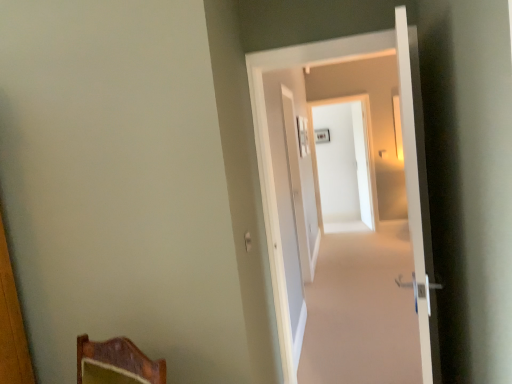
Question: Which direction should I rotate to look at white glossy screen door at center, acting as the second screen door starting from the left?

Choices:
 (A) right
 (B) left

Answer: (A)

Question: Is white glossy door at center, arranged as the 2th screen door when viewed from the right, not near white glossy door at center, acting as the second door starting from the front?

Choices:
 (A) yes
 (B) no

Answer: (A)

Question: Does white glossy door at center, marked as the 1th screen door in a front-to-back arrangement, appear on the left side of white glossy door at center, acting as the second door starting from the front?

Choices:
 (A) yes
 (B) no

Answer: (A)

Question: Is white glossy door at center, arranged as the 2th screen door when viewed from the right, turned away from white glossy door at center, acting as the second door starting from the front?

Choices:
 (A) yes
 (B) no

Answer: (B)

Question: From a real-world perspective, is white glossy door at center, the 2th screen door in the back-to-front sequence, on white glossy door at center, acting as the second door starting from the front?

Choices:
 (A) no
 (B) yes

Answer: (A)

Question: Is white glossy door at center, marked as the 1th screen door in a front-to-back arrangement, placed right next to white glossy door at center, acting as the second door starting from the front?

Choices:
 (A) yes
 (B) no

Answer: (B)

Question: Is white glossy door at center, the 2th screen door in the back-to-front sequence, bigger than white glossy door at center, acting as the second door starting from the front?

Choices:
 (A) no
 (B) yes

Answer: (B)

Question: Is white glossy door at right, marked as the second door in a back-to-front arrangement, positioned before white glossy door at center, positioned as the first screen door in left-to-right order?

Choices:
 (A) yes
 (B) no

Answer: (A)

Question: Is white glossy door at right, the first door in the front-to-back sequence, bigger than white glossy door at center, the 2th screen door in the back-to-front sequence?

Choices:
 (A) yes
 (B) no

Answer: (A)

Question: Is white glossy door at right, the first door in the front-to-back sequence, to the right of white glossy door at center, positioned as the first screen door in left-to-right order, from the viewer's perspective?

Choices:
 (A) yes
 (B) no

Answer: (A)

Question: Is white glossy door at right, the first door in the front-to-back sequence, not inside white glossy door at center, positioned as the first screen door in left-to-right order?

Choices:
 (A) yes
 (B) no

Answer: (A)

Question: From the image's perspective, is white glossy door at right, marked as the second door in a back-to-front arrangement, under white glossy door at center, marked as the 1th screen door in a front-to-back arrangement?

Choices:
 (A) yes
 (B) no

Answer: (A)

Question: From a real-world perspective, is white glossy door at right, the first door in the front-to-back sequence, under white glossy door at center, the 2th screen door in the back-to-front sequence?

Choices:
 (A) yes
 (B) no

Answer: (B)

Question: From a real-world perspective, is white glossy door at center, arranged as the 2th screen door when viewed from the right, located beneath white glossy door at right, marked as the second door in a back-to-front arrangement?

Choices:
 (A) no
 (B) yes

Answer: (B)